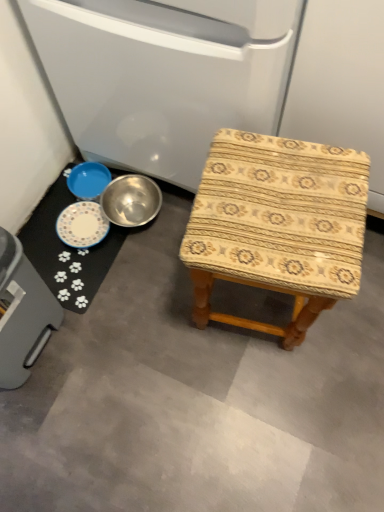
What is the approximate width of white paw print mat at lower left?

The width of white paw print mat at lower left is 11.94 inches.

What is the approximate height of gray plastic trash can at lower left, the 2th appliance when ordered from right to left?

The height of gray plastic trash can at lower left, the 2th appliance when ordered from right to left, is 44.30 centimeters.

Find the location of a particular element. This screenshot has height=512, width=384. metallic bowl at lower left, the 1th appliance when ordered from top to bottom is located at coordinates (164, 75).

What do you see at coordinates (88, 180) in the screenshot? I see `blue metallic bowl at lower left` at bounding box center [88, 180].

The width and height of the screenshot is (384, 512). In order to click on blue metallic bowl at lower left in this screenshot , I will do (x=88, y=180).

The height and width of the screenshot is (512, 384). Find the location of `white paw print mat at lower left`. white paw print mat at lower left is located at coordinates (67, 250).

Looking at this image, considering the positions of objects white paw print mat at lower left and metallic bowl at lower left, which ranks as the 1th appliance in right-to-left order, in the image provided, who is more to the left, white paw print mat at lower left or metallic bowl at lower left, which ranks as the 1th appliance in right-to-left order,?

Positioned to the left is white paw print mat at lower left.

Are white paw print mat at lower left and metallic bowl at lower left, the 2th appliance positioned from the left, far apart?

white paw print mat at lower left is actually quite close to metallic bowl at lower left, the 2th appliance positioned from the left.

From a real-world perspective, which is physically below, white paw print mat at lower left or metallic bowl at lower left, the 1th appliance when ordered from top to bottom?

white paw print mat at lower left.

Who is more distant, blue metallic bowl at lower left or metallic bowl at lower left, the 1th appliance when ordered from top to bottom?

blue metallic bowl at lower left is behind.

From a real-world perspective, does blue metallic bowl at lower left sit lower than metallic bowl at lower left, the 1th appliance when ordered from top to bottom?

Indeed, from a real-world perspective, blue metallic bowl at lower left is positioned beneath metallic bowl at lower left, the 1th appliance when ordered from top to bottom.

Is blue metallic bowl at lower left taller than metallic bowl at lower left, which ranks as the 1th appliance in right-to-left order?

Incorrect, the height of blue metallic bowl at lower left is not larger of that of metallic bowl at lower left, which ranks as the 1th appliance in right-to-left order.

What's the angular difference between blue metallic bowl at lower left and metallic bowl at lower left, which ranks as the 1th appliance in right-to-left order,'s facing directions?

blue metallic bowl at lower left and metallic bowl at lower left, which ranks as the 1th appliance in right-to-left order, are facing 90.3 degrees away from each other.

Is blue metallic bowl at lower left beside wooden-patterned stool at center?

No, blue metallic bowl at lower left is not touching wooden-patterned stool at center.

Is blue metallic bowl at lower left facing towards wooden-patterned stool at center?

Yes.

Consider the image. From the image's perspective, which one is positioned lower, blue metallic bowl at lower left or wooden-patterned stool at center?

wooden-patterned stool at center appears lower in the image.

Between point (83, 176) and point (296, 300), which one is positioned behind?

The point (83, 176) is behind.

Is metallic bowl at lower left, which ranks as the 1th appliance in right-to-left order, to the left or to the right of white paw print mat at lower left in the image?

In the image, metallic bowl at lower left, which ranks as the 1th appliance in right-to-left order, appears on the right side of white paw print mat at lower left.

From a real-world perspective, is metallic bowl at lower left, acting as the second appliance starting from the bottom, beneath white paw print mat at lower left?

Actually, metallic bowl at lower left, acting as the second appliance starting from the bottom, is physically above white paw print mat at lower left in the real world.

Is metallic bowl at lower left, acting as the second appliance starting from the bottom, beside white paw print mat at lower left?

metallic bowl at lower left, acting as the second appliance starting from the bottom, and white paw print mat at lower left are not in contact.

Between metallic bowl at lower left, acting as the second appliance starting from the bottom, and white paw print mat at lower left, which one has larger width?

metallic bowl at lower left, acting as the second appliance starting from the bottom.

Measure the distance between white paw print mat at lower left and wooden-patterned stool at center.

The distance of white paw print mat at lower left from wooden-patterned stool at center is 53.99 centimeters.

Which is more to the left, white paw print mat at lower left or wooden-patterned stool at center?

From the viewer's perspective, white paw print mat at lower left appears more on the left side.

Is white paw print mat at lower left closer to the viewer compared to wooden-patterned stool at center?

No, the depth of white paw print mat at lower left is greater than that of wooden-patterned stool at center.

From a real-world perspective, who is located higher, white paw print mat at lower left or wooden-patterned stool at center?

wooden-patterned stool at center.

Consider the image. Is blue metallic bowl at lower left oriented towards white paw print mat at lower left?

No, blue metallic bowl at lower left is not aimed at white paw print mat at lower left.

How distant is blue metallic bowl at lower left from white paw print mat at lower left?

blue metallic bowl at lower left is 6.68 inches from white paw print mat at lower left.

What are the coordinates of `mat to the left of blue metallic bowl at lower left` in the screenshot? It's located at (67, 250).

From a real-world perspective, is blue metallic bowl at lower left positioned above or below white paw print mat at lower left?

Clearly, from a real-world perspective, blue metallic bowl at lower left is above white paw print mat at lower left.

Is metallic bowl at lower left, which ranks as the 1th appliance in right-to-left order, positioned far away from gray plastic trash can at lower left, which is counted as the first appliance, starting from the left?

No, there isn't a large distance between metallic bowl at lower left, which ranks as the 1th appliance in right-to-left order, and gray plastic trash can at lower left, which is counted as the first appliance, starting from the left.

Is the depth of metallic bowl at lower left, the 2th appliance positioned from the left, greater than that of gray plastic trash can at lower left, the 2th appliance when ordered from right to left?

Yes, metallic bowl at lower left, the 2th appliance positioned from the left, is further from the camera.

How many degrees apart are the facing directions of metallic bowl at lower left, the 2th appliance positioned from the left, and gray plastic trash can at lower left, which is counted as the first appliance, starting from the left?

They differ by 89.5 degrees in their facing directions.

The height and width of the screenshot is (512, 384). What are the coordinates of `appliance lying in front of the metallic bowl at lower left, which ranks as the 1th appliance in right-to-left order` in the screenshot? It's located at (22, 313).

This screenshot has width=384, height=512. What are the coordinates of `mat below the metallic bowl at lower left, the 2th appliance positioned from the left (from a real-world perspective)` in the screenshot? It's located at (67, 250).

From a real-world perspective, which appliance is the 2nd one above the blue metallic bowl at lower left? Please provide its 2D coordinates.

[(164, 75)]

From the image, which object appears to be nearer to blue metallic bowl at lower left, wooden-patterned stool at center or metallic bowl at lower left, which ranks as the 1th appliance in right-to-left order?

metallic bowl at lower left, which ranks as the 1th appliance in right-to-left order, is positioned closer to the anchor blue metallic bowl at lower left.

From the image, which object appears to be nearer to wooden-patterned stool at center, blue metallic bowl at lower left or gray plastic trash can at lower left, acting as the second appliance starting from the top?

gray plastic trash can at lower left, acting as the second appliance starting from the top.

Based on the photo, based on their spatial positions, is gray plastic trash can at lower left, which is counted as the first appliance, starting from the left, or blue metallic bowl at lower left closer to metallic bowl at lower left, which ranks as the 1th appliance in right-to-left order?

blue metallic bowl at lower left lies closer to metallic bowl at lower left, which ranks as the 1th appliance in right-to-left order, than the other object.

From the image, which object appears to be nearer to gray plastic trash can at lower left, acting as the second appliance starting from the top, blue metallic bowl at lower left or metallic bowl at lower left, the 1th appliance when ordered from top to bottom?

blue metallic bowl at lower left is closer to gray plastic trash can at lower left, acting as the second appliance starting from the top.

Considering their positions, is white paw print mat at lower left positioned further to gray plastic trash can at lower left, the 2th appliance when ordered from right to left, than metallic bowl at lower left, the 2th appliance positioned from the left?

Based on the image, metallic bowl at lower left, the 2th appliance positioned from the left, appears to be further to gray plastic trash can at lower left, the 2th appliance when ordered from right to left.

Based on their spatial positions, is gray plastic trash can at lower left, which ranks as the first appliance in bottom-to-top order, or metallic bowl at lower left, acting as the second appliance starting from the bottom, further from wooden-patterned stool at center?

gray plastic trash can at lower left, which ranks as the first appliance in bottom-to-top order, lies further to wooden-patterned stool at center than the other object.

Based on their spatial positions, is wooden-patterned stool at center or metallic bowl at lower left, acting as the second appliance starting from the bottom, closer to white paw print mat at lower left?

Among the two, metallic bowl at lower left, acting as the second appliance starting from the bottom, is located nearer to white paw print mat at lower left.

Based on their spatial positions, is metallic bowl at lower left, acting as the second appliance starting from the bottom, or blue metallic bowl at lower left further from white paw print mat at lower left?

Based on the image, metallic bowl at lower left, acting as the second appliance starting from the bottom, appears to be further to white paw print mat at lower left.

Image resolution: width=384 pixels, height=512 pixels. In order to click on stool between gray plastic trash can at lower left, which is counted as the first appliance, starting from the left, and blue metallic bowl at lower left, along the z-axis in this screenshot , I will do `click(278, 225)`.

I want to click on mat located between metallic bowl at lower left, acting as the second appliance starting from the bottom, and blue metallic bowl at lower left in the depth direction, so click(67, 250).

Locate an element on the screen. The height and width of the screenshot is (512, 384). basin that lies between metallic bowl at lower left, acting as the second appliance starting from the bottom, and gray plastic trash can at lower left, which ranks as the first appliance in bottom-to-top order, from top to bottom is located at coordinates (88, 180).

Image resolution: width=384 pixels, height=512 pixels. What are the coordinates of `mat positioned between gray plastic trash can at lower left, the 2th appliance when ordered from right to left, and blue metallic bowl at lower left from near to far` in the screenshot? It's located at (67, 250).